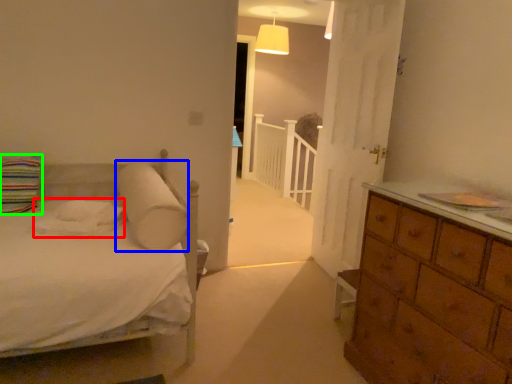
Question: Based on their relative distances, which object is nearer to sheet (highlighted by a red box)? Choose from pillow (highlighted by a blue box) and pillow (highlighted by a green box).

Choices:
 (A) pillow
 (B) pillow

Answer: (A)